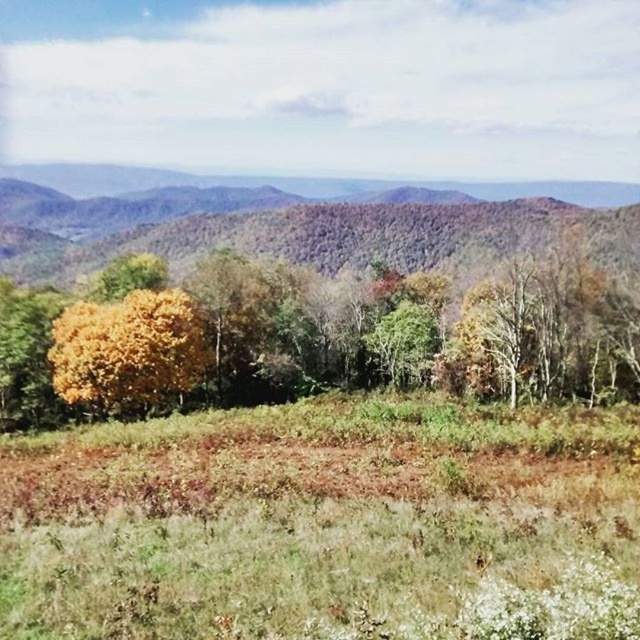
Who is positioned more to the right, brown dry grass at lower center or green leafy forest at upper center?

brown dry grass at lower center

Between point (524, 579) and point (488, 186), which one is positioned behind?

Point (488, 186)

What are the coordinates of `brown dry grass at lower center` in the screenshot? It's located at (324, 524).

Can you confirm if green leafy forest at upper center is positioned above golden yellow leaves at center?

Correct, green leafy forest at upper center is located above golden yellow leaves at center.

Between green leafy forest at upper center and golden yellow leaves at center, which one is positioned higher?

Positioned higher is green leafy forest at upper center.

The image size is (640, 640). What do you see at coordinates (296, 220) in the screenshot?
I see `green leafy forest at upper center` at bounding box center [296, 220].

Identify the location of green leafy forest at upper center. The width and height of the screenshot is (640, 640). (296, 220).

Which is behind, point (216, 330) or point (160, 323)?

The point (216, 330) is behind.

Based on the photo, who is taller, yellow leafy tree at center or golden yellow leaves at center?

Standing taller between the two is yellow leafy tree at center.

Identify the location of yellow leafy tree at center. (355, 337).

The image size is (640, 640). What are the coordinates of `yellow leafy tree at center` in the screenshot? It's located at (355, 337).